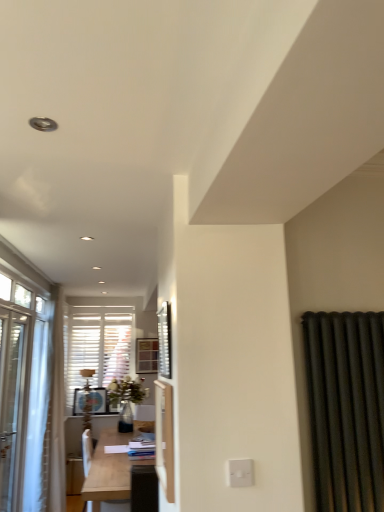
Question: Considering the relative positions of white glossy screen door at center and white plastic switch at lower center in the image provided, is white glossy screen door at center in front of white plastic switch at lower center?

Choices:
 (A) no
 (B) yes

Answer: (A)

Question: From a real-world perspective, is white glossy screen door at center over white plastic switch at lower center?

Choices:
 (A) yes
 (B) no

Answer: (A)

Question: Can you confirm if white glossy screen door at center is taller than white plastic switch at lower center?

Choices:
 (A) yes
 (B) no

Answer: (A)

Question: Is white plastic switch at lower center completely or partially inside white glossy screen door at center?

Choices:
 (A) no
 (B) yes

Answer: (A)

Question: Can you confirm if white glossy screen door at center is shorter than white plastic switch at lower center?

Choices:
 (A) no
 (B) yes

Answer: (A)

Question: Does white glossy screen door at center have a larger size compared to white plastic switch at lower center?

Choices:
 (A) yes
 (B) no

Answer: (A)

Question: Is metallic silver window screen at center looking in the opposite direction of white glossy screen door at center?

Choices:
 (A) yes
 (B) no

Answer: (B)

Question: From a real-world perspective, does metallic silver window screen at center sit lower than white glossy screen door at center?

Choices:
 (A) no
 (B) yes

Answer: (A)

Question: Does metallic silver window screen at center have a smaller size compared to white glossy screen door at center?

Choices:
 (A) yes
 (B) no

Answer: (A)

Question: Is metallic silver window screen at center facing towards white glossy screen door at center?

Choices:
 (A) yes
 (B) no

Answer: (B)

Question: Considering the relative sizes of metallic silver window screen at center and white glossy screen door at center in the image provided, is metallic silver window screen at center taller than white glossy screen door at center?

Choices:
 (A) no
 (B) yes

Answer: (A)

Question: Considering the relative positions of metallic silver window screen at center and white glossy screen door at center in the image provided, is metallic silver window screen at center behind white glossy screen door at center?

Choices:
 (A) no
 (B) yes

Answer: (B)

Question: Considering the relative positions of white glossy screen door at center and metallic silver window screen at center in the image provided, is white glossy screen door at center behind metallic silver window screen at center?

Choices:
 (A) no
 (B) yes

Answer: (A)